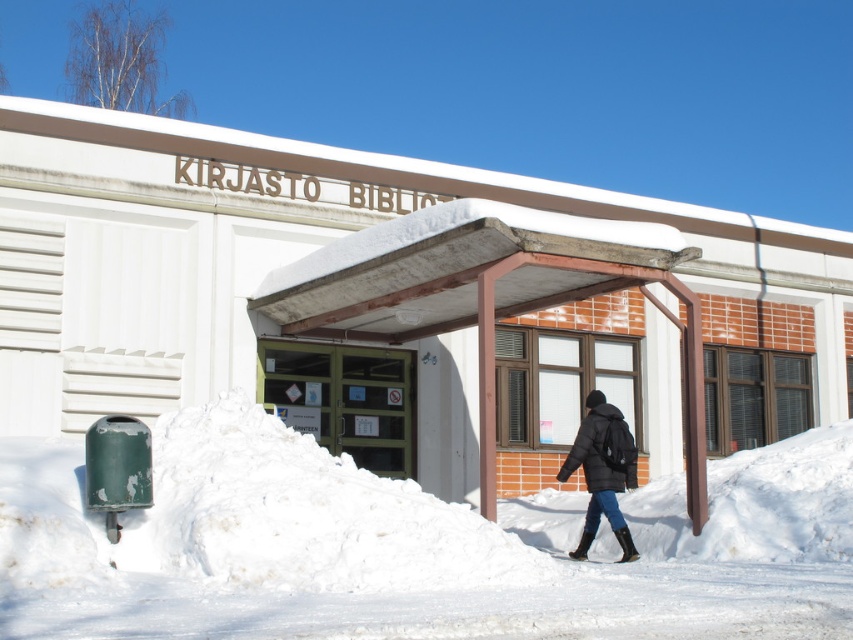
Question: Is white fluffy snow at lower center bigger than black puffy coat at center?

Choices:
 (A) yes
 (B) no

Answer: (A)

Question: Which point is closer to the camera?

Choices:
 (A) (625, 470)
 (B) (99, 560)

Answer: (B)

Question: Is wooden awning at center wider than black puffy coat at center?

Choices:
 (A) no
 (B) yes

Answer: (B)

Question: Which of the following is the farthest from the observer?

Choices:
 (A) (486, 339)
 (B) (606, 413)
 (C) (669, 582)

Answer: (B)

Question: Can you confirm if wooden awning at center is thinner than black puffy coat at center?

Choices:
 (A) no
 (B) yes

Answer: (A)

Question: Which point is closer to the camera?

Choices:
 (A) wooden awning at center
 (B) black puffy coat at center
 (C) white fluffy snow at lower center

Answer: (C)